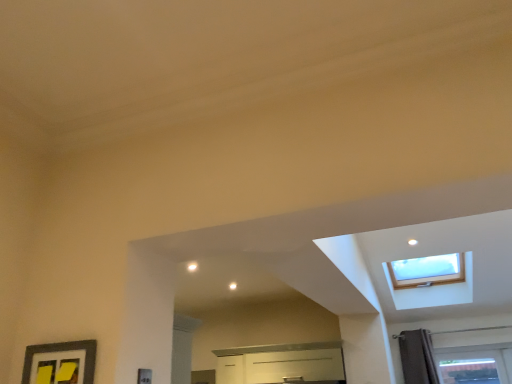
This screenshot has height=384, width=512. What do you see at coordinates (60, 363) in the screenshot?
I see `matte black picture frame at lower left` at bounding box center [60, 363].

Looking at this image, what is the approximate width of matte black picture frame at lower left?

matte black picture frame at lower left is 1.60 inches in width.

I want to click on matte black picture frame at lower left, so click(x=60, y=363).

In order to click on matte black picture frame at lower left in this screenshot , I will do `click(60, 363)`.